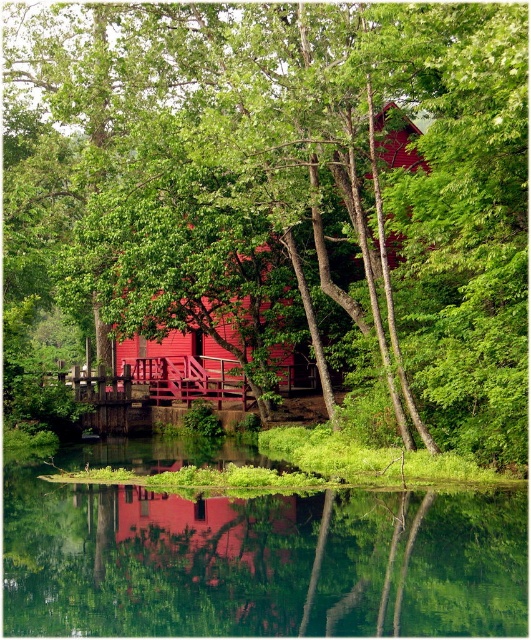
What is the exact location of the clear glass water at center in the image?

The clear glass water at center is located at point (261, 561).

You are standing on the wooden staircase leading to the porch of the matte red cabin at center. Looking forward, which object is positioned to the right of the green leafy tree at center?

The matte red cabin at center is positioned to the right of the green leafy tree at center.

You are a photographer wanting to capture the matte red cabin at center and the green leafy tree at center in a single frame. Based on their sizes, which object should you focus on to ensure both are visible without cropping?

The green leafy tree at center is bigger than the matte red cabin at center, so focusing on the larger green leafy tree at center will ensure both objects are visible in the frame.